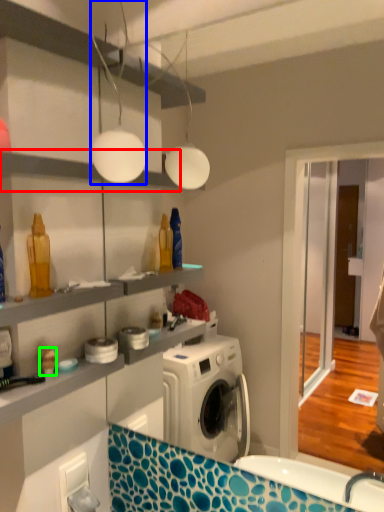
Question: Estimate the real-world distances between objects in this image. Which object is farther from shelf (highlighted by a red box), light fixture (highlighted by a blue box) or toy (highlighted by a green box)?

Choices:
 (A) light fixture
 (B) toy

Answer: (B)